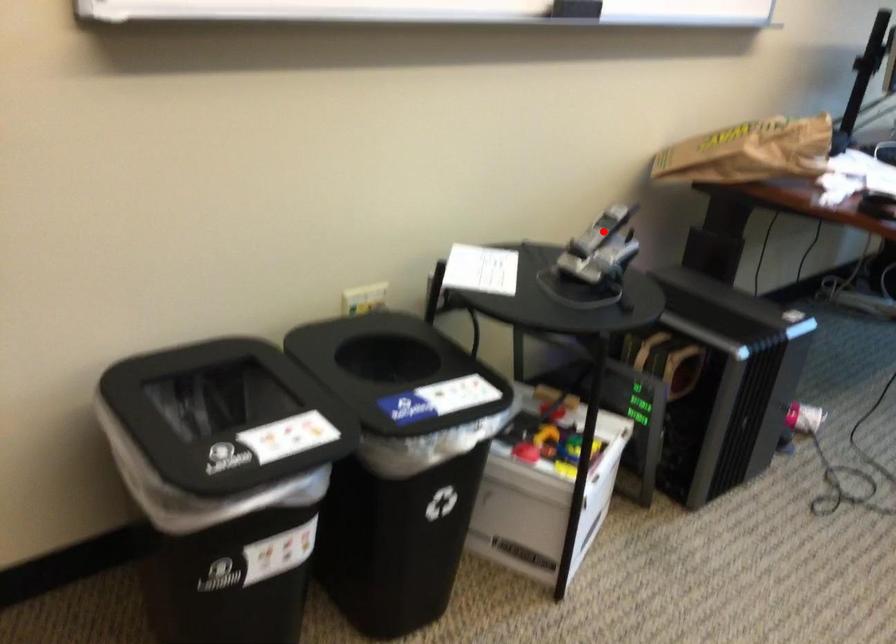
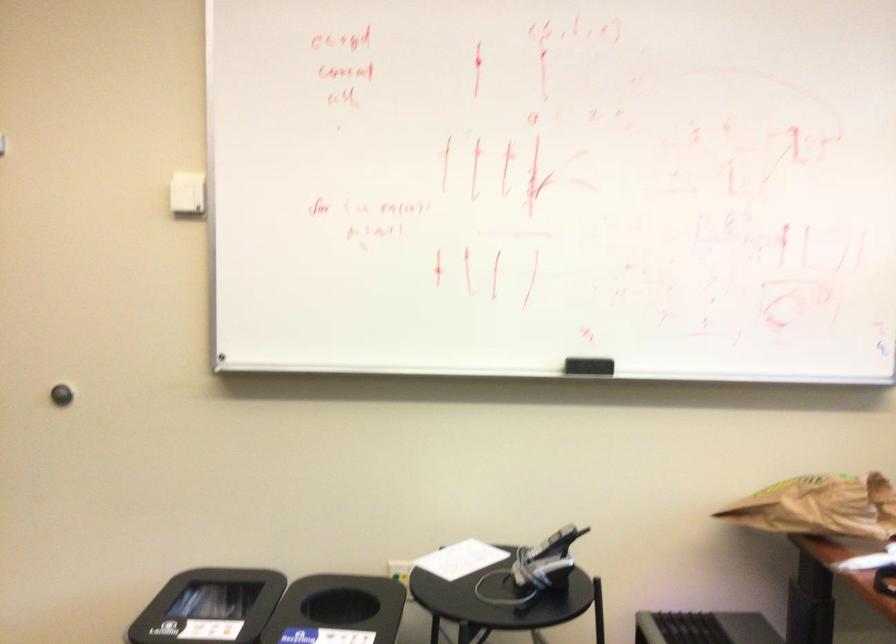
Locate, in the second image, the point that corresponds to the highlighted location in the first image.

(552, 544)